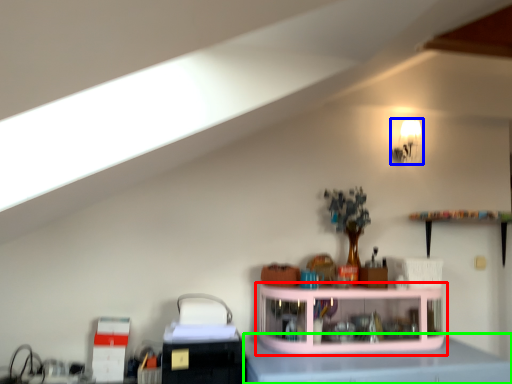
Question: Estimate the real-world distances between objects in this image. Which object is farther from shelf (highlighted by a red box), light fixture (highlighted by a blue box) or counter top (highlighted by a green box)?

Choices:
 (A) light fixture
 (B) counter top

Answer: (A)